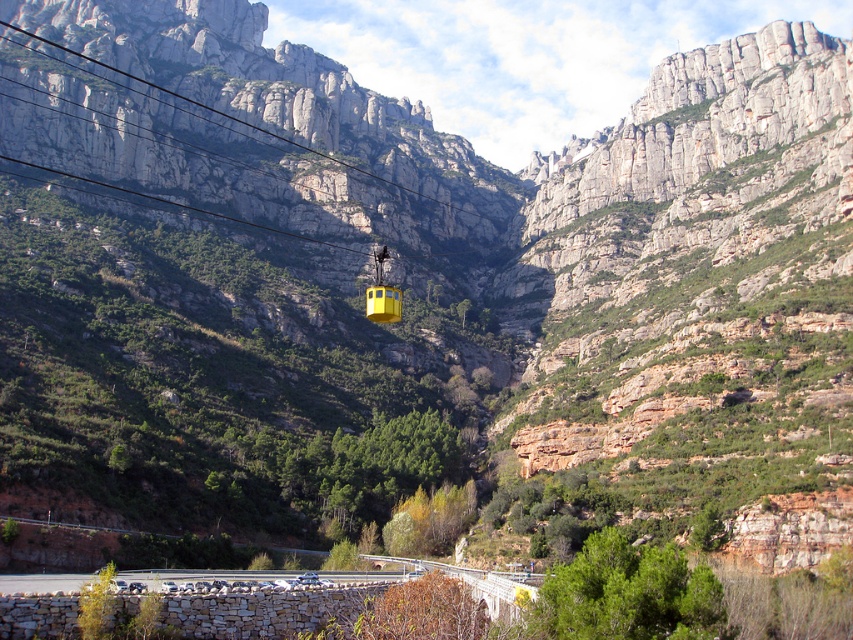
Question: Does smooth wire at upper center have a greater width compared to yellow matte cable car at center?

Choices:
 (A) no
 (B) yes

Answer: (B)

Question: Which of the following is the farthest from the observer?

Choices:
 (A) smooth wire at upper center
 (B) yellow matte cable car at center

Answer: (A)

Question: Which point is closer to the camera?

Choices:
 (A) smooth wire at upper center
 (B) yellow matte cable car at center

Answer: (B)

Question: Does smooth wire at upper center have a smaller size compared to yellow matte cable car at center?

Choices:
 (A) yes
 (B) no

Answer: (B)

Question: Does smooth wire at upper center appear on the left side of yellow matte cable car at center?

Choices:
 (A) no
 (B) yes

Answer: (B)